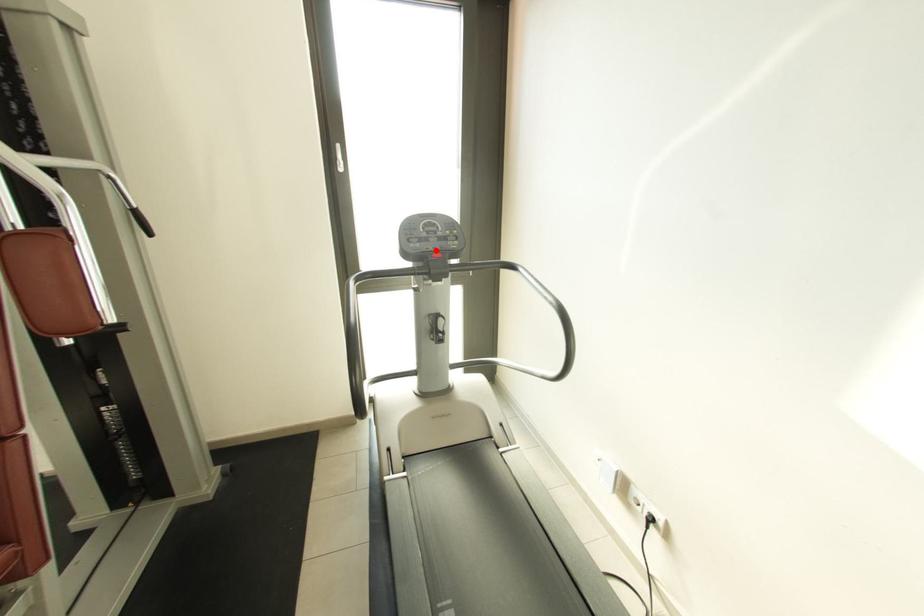
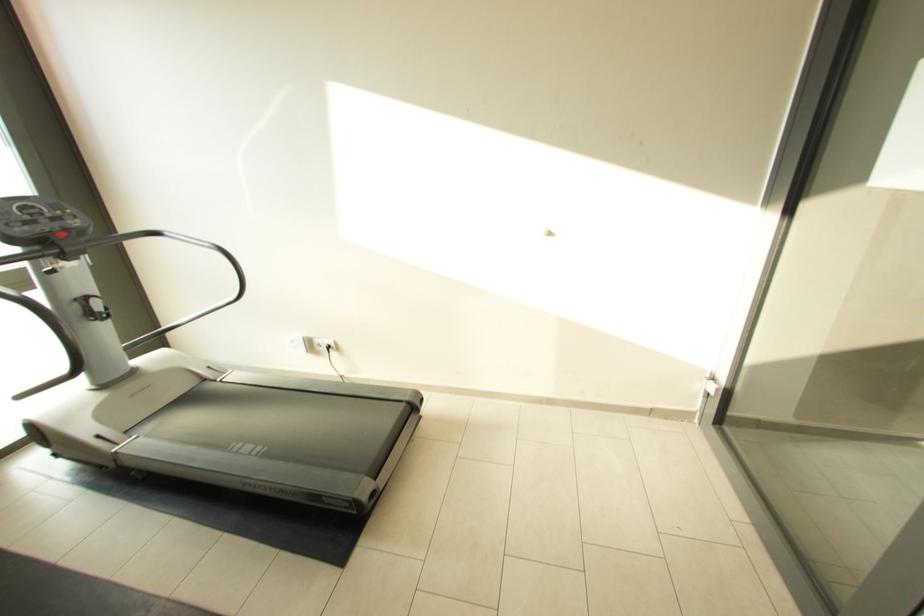
Where in the second image is the point corresponding to the highlighted location from the first image?

(54, 232)